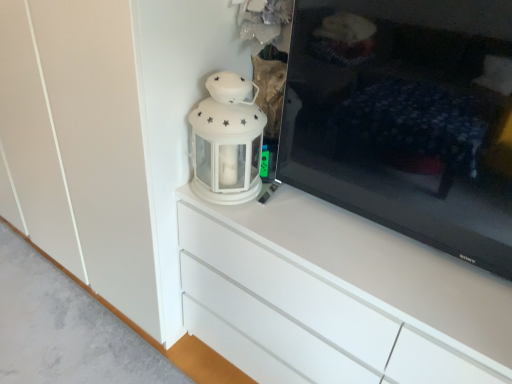
This screenshot has height=384, width=512. In order to click on vacant space in front of black glossy tv at right in this screenshot , I will do `click(406, 277)`.